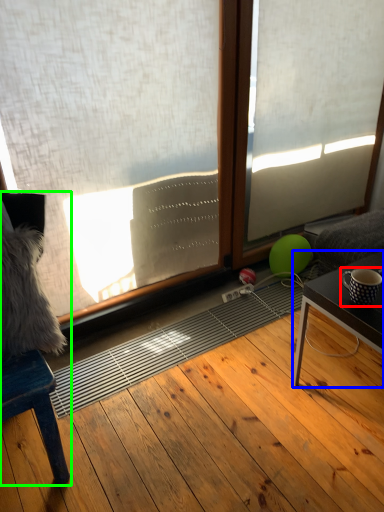
Question: Considering the real-world distances, which object is closest to coffee cup (highlighted by a red box)? table (highlighted by a blue box) or furniture (highlighted by a green box).

Choices:
 (A) table
 (B) furniture

Answer: (A)